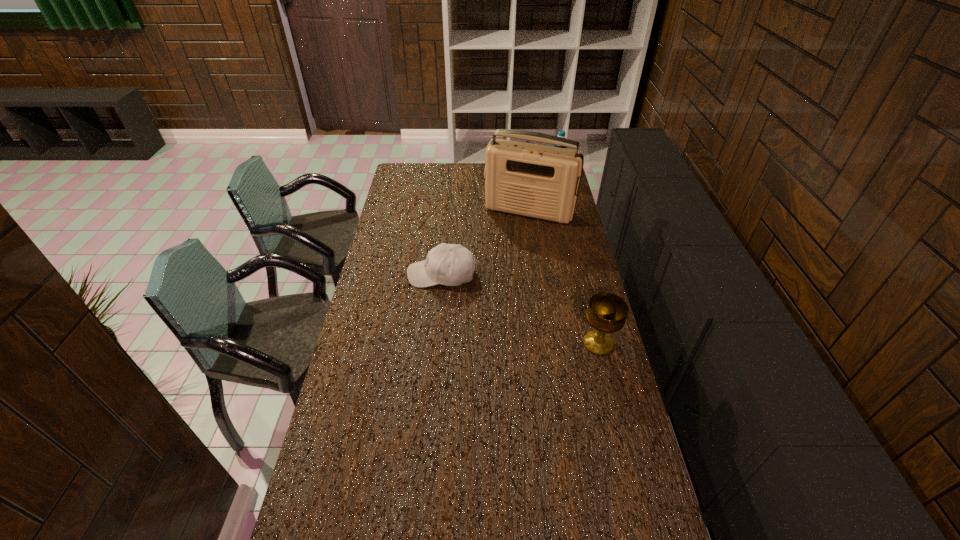
Locate an element on the screen. This screenshot has height=540, width=960. chalice present at the right edge is located at coordinates (606, 313).

Where is `radio receiver that is at the right edge`? The height and width of the screenshot is (540, 960). radio receiver that is at the right edge is located at coordinates (532, 180).

The height and width of the screenshot is (540, 960). Find the location of `water bottle located at the right edge`. water bottle located at the right edge is located at coordinates (561, 133).

Where is `object situated at the far right corner`? This screenshot has height=540, width=960. object situated at the far right corner is located at coordinates (561, 133).

Where is `vacant space at the far edge`? vacant space at the far edge is located at coordinates (455, 178).

Identify the location of vacant space at the near edge of the desktop. Image resolution: width=960 pixels, height=540 pixels. (548, 529).

The height and width of the screenshot is (540, 960). In order to click on blank area at the left edge in this screenshot , I will do `click(312, 486)`.

In the image, there is a desktop. Where is `vacant region at the right edge`? Image resolution: width=960 pixels, height=540 pixels. vacant region at the right edge is located at coordinates 564,247.

Where is `free area in between the leftmost object and the farthest object`? The height and width of the screenshot is (540, 960). free area in between the leftmost object and the farthest object is located at coordinates (499, 225).

At what (x,y) coordinates should I click in order to perform the action: click on free space between the tallest object and the chalice. Please return your answer as a coordinate pair (x, y). Looking at the image, I should click on (564, 277).